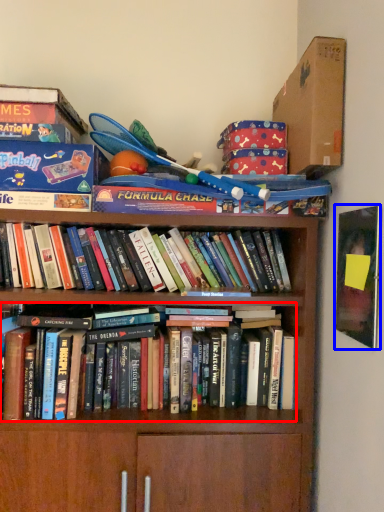
Question: Which object appears farthest to the camera in this image, book (highlighted by a red box) or paperback book (highlighted by a blue box)?

Choices:
 (A) book
 (B) paperback book

Answer: (A)